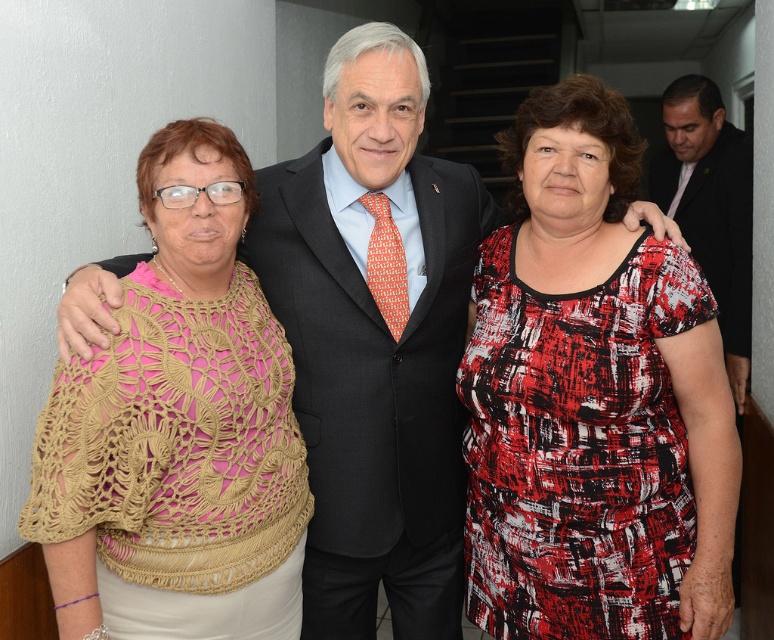
Question: Which point is closer to the camera?

Choices:
 (A) (156, 356)
 (B) (687, 451)
 (C) (302, 225)
 (D) (728, 122)

Answer: (A)

Question: Estimate the real-world distances between objects in this image. Which object is farther from the dark suit at right?

Choices:
 (A) black wool suit at center
 (B) red and black printed dress at right
 (C) crochet beige shawl at left

Answer: (C)

Question: Does red and black printed dress at right appear on the right side of dark suit at right?

Choices:
 (A) no
 (B) yes

Answer: (A)

Question: Can you confirm if red and black printed dress at right is smaller than black wool suit at center?

Choices:
 (A) yes
 (B) no

Answer: (A)

Question: Which object appears closest to the camera in this image?

Choices:
 (A) red and black printed dress at right
 (B) black wool suit at center
 (C) crochet beige shawl at left
 (D) dark suit at right

Answer: (C)

Question: Does dark suit at right have a larger size compared to black wool suit at center?

Choices:
 (A) yes
 (B) no

Answer: (A)